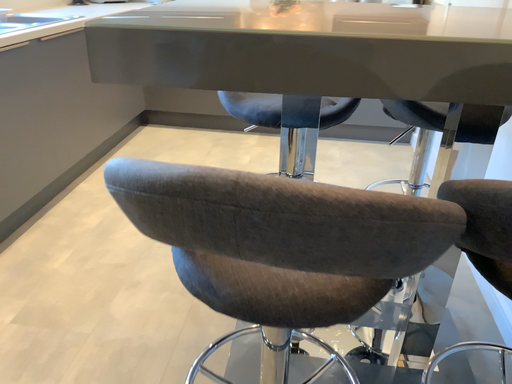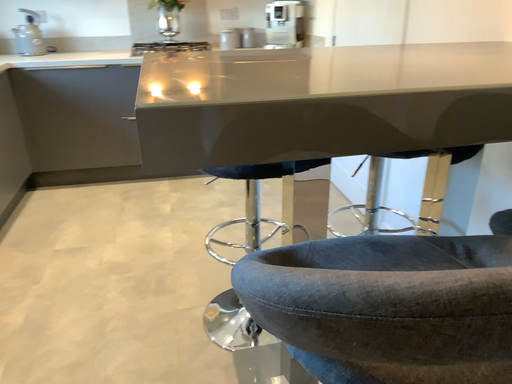
Question: Which way did the camera rotate in the video?

Choices:
 (A) rotated left
 (B) rotated right

Answer: (B)